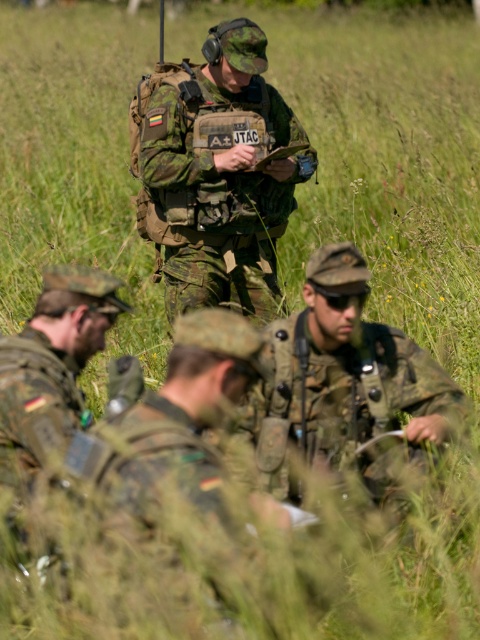
Question: Among these objects, which one is farthest from the camera?

Choices:
 (A) camouflage fabric uniform at center
 (B) camouflage uniform at center

Answer: (A)

Question: Which object is the closest to the camouflage uniform at center?

Choices:
 (A) camouflage uniform at lower left
 (B) camouflage fabric uniform at center

Answer: (A)

Question: Considering the relative positions of camouflage fabric uniform at center and camouflage uniform at center in the image provided, where is camouflage fabric uniform at center located with respect to camouflage uniform at center?

Choices:
 (A) left
 (B) right

Answer: (A)

Question: Is camouflage fabric uniform at center to the right of camouflage uniform at center from the viewer's perspective?

Choices:
 (A) yes
 (B) no

Answer: (B)

Question: Estimate the real-world distances between objects in this image. Which object is farther from the camouflage uniform at lower left?

Choices:
 (A) camouflage fabric uniform at center
 (B) camouflage uniform at center

Answer: (A)

Question: In this image, where is camouflage uniform at center located relative to camouflage uniform at lower left?

Choices:
 (A) left
 (B) right

Answer: (B)